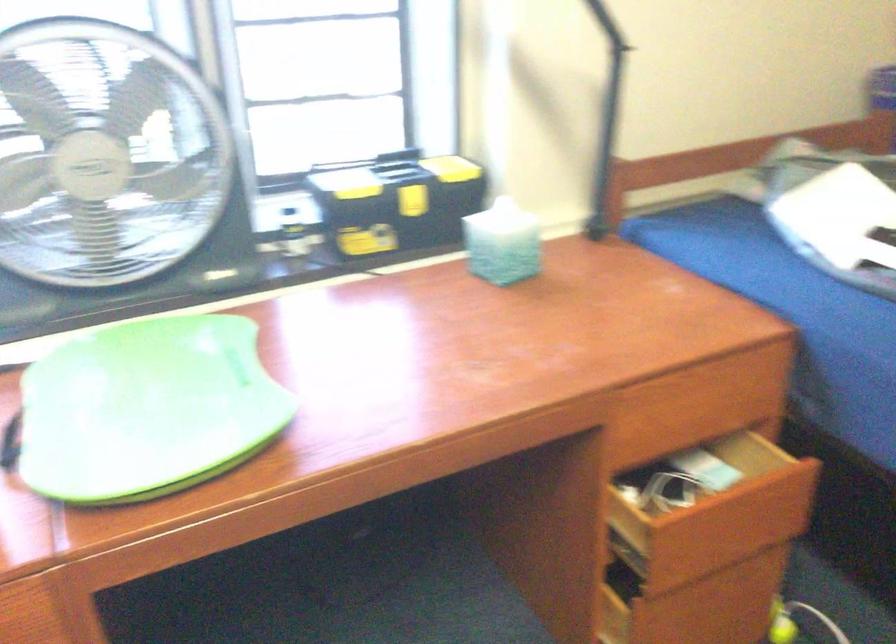
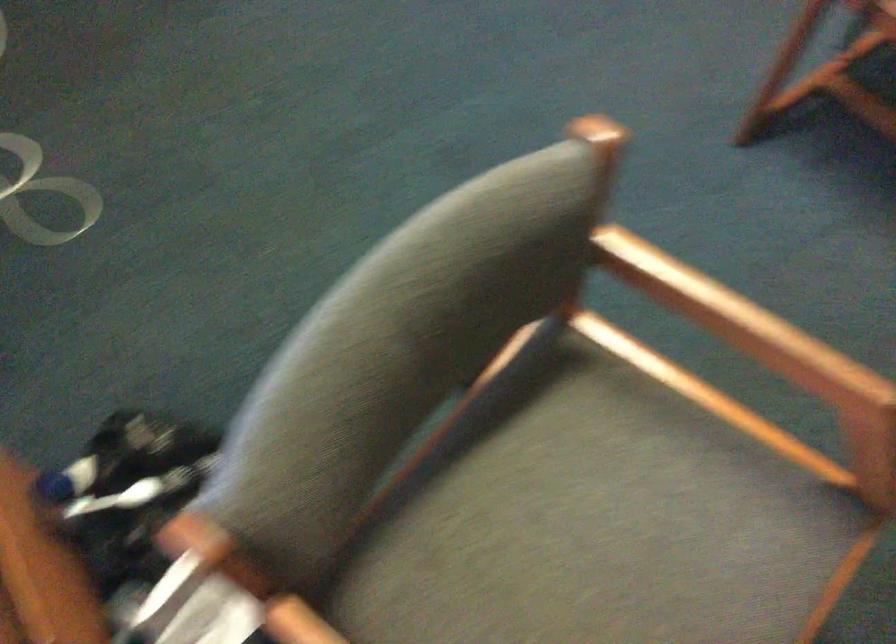
The first image is from the beginning of the video and the second image is from the end. How did the camera likely rotate when shooting the video?

The camera rotated toward right-down.